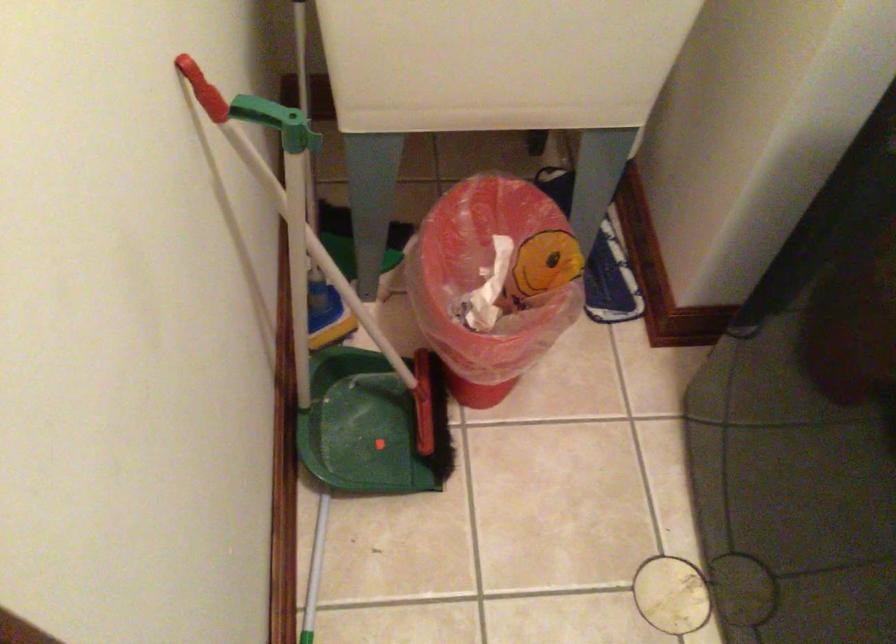
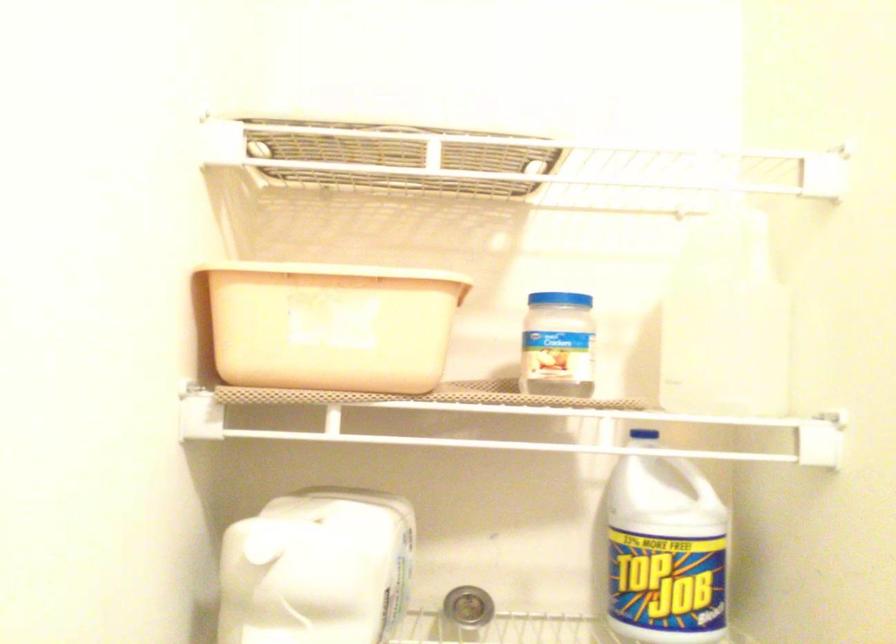
Question: The first image is from the beginning of the video and the second image is from the end. How did the camera likely rotate when shooting the video?

Choices:
 (A) Left
 (B) Right
 (C) Up
 (D) Down

Answer: (C)